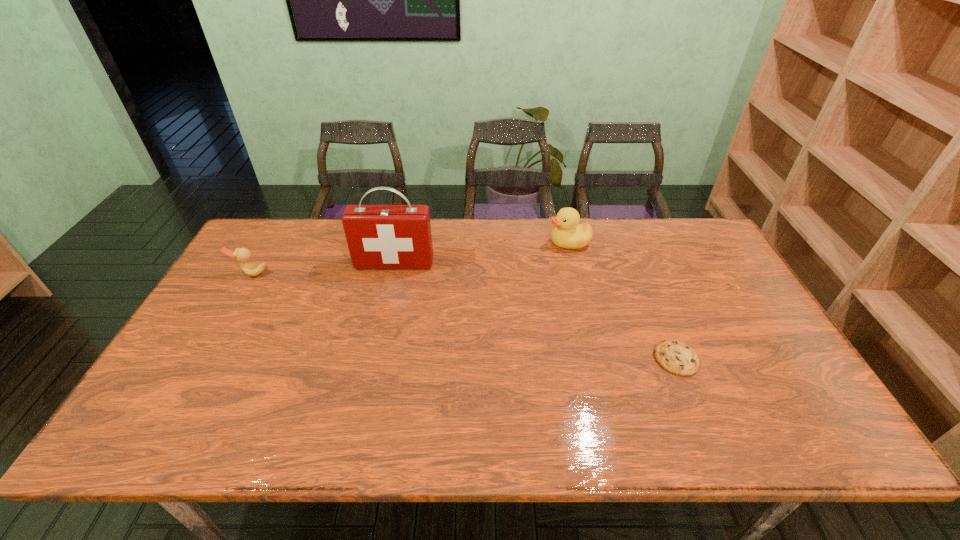
Locate an element on the screen. This screenshot has height=540, width=960. vacant area situated 0.280m at the beak of the second object from right to left is located at coordinates (465, 242).

Find the location of a particular element. The height and width of the screenshot is (540, 960). vacant region located at the beak of the second object from right to left is located at coordinates (476, 242).

I want to click on vacant region located on the beak of the left duck, so click(x=185, y=388).

I want to click on blank space located 0.140m on the right of the shortest object, so click(x=752, y=359).

What are the coordinates of `the first-aid kit present at the far edge` in the screenshot? It's located at (378, 236).

At what (x,y) coordinates should I click in order to perform the action: click on duck that is positioned at the far edge. Please return your answer as a coordinate pair (x, y). The height and width of the screenshot is (540, 960). Looking at the image, I should click on (568, 233).

Identify the location of object that is positioned at the left edge. (241, 255).

Identify the location of vacant area at the far edge of the desktop. This screenshot has height=540, width=960. (331, 233).

I want to click on free spot at the near edge of the desktop, so click(x=423, y=431).

In the image, there is a desktop. Where is `vacant space at the left edge`? This screenshot has width=960, height=540. vacant space at the left edge is located at coordinates (228, 305).